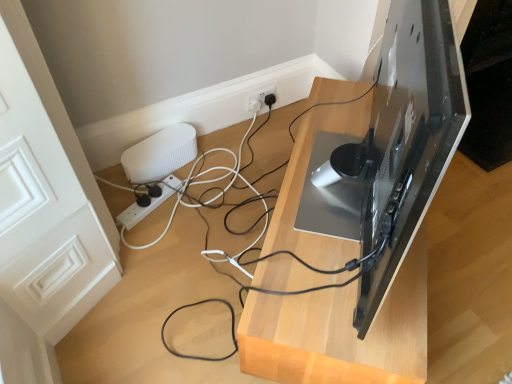
Locate an element on the screen. This screenshot has width=512, height=384. free location to the right of black glossy tv stand at upper right is located at coordinates (466, 256).